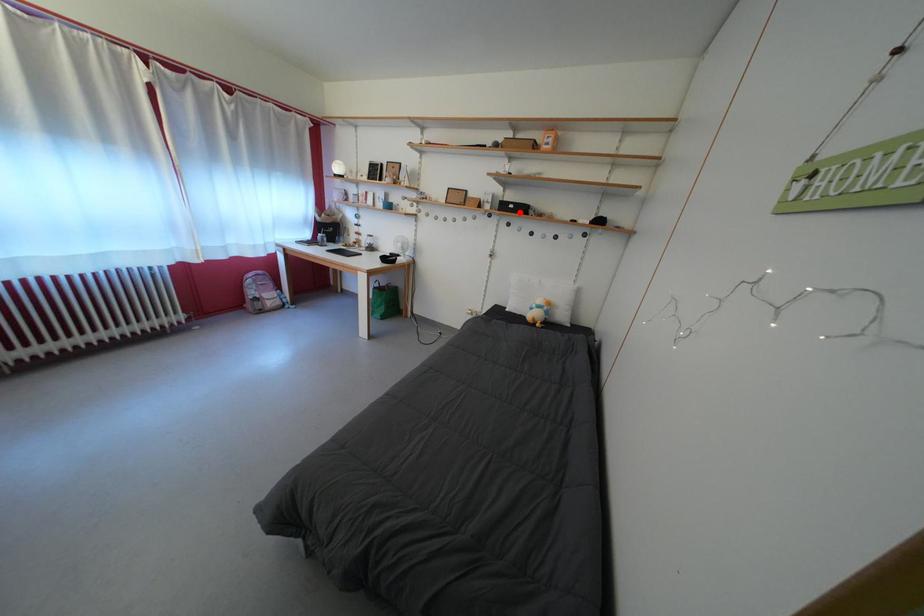
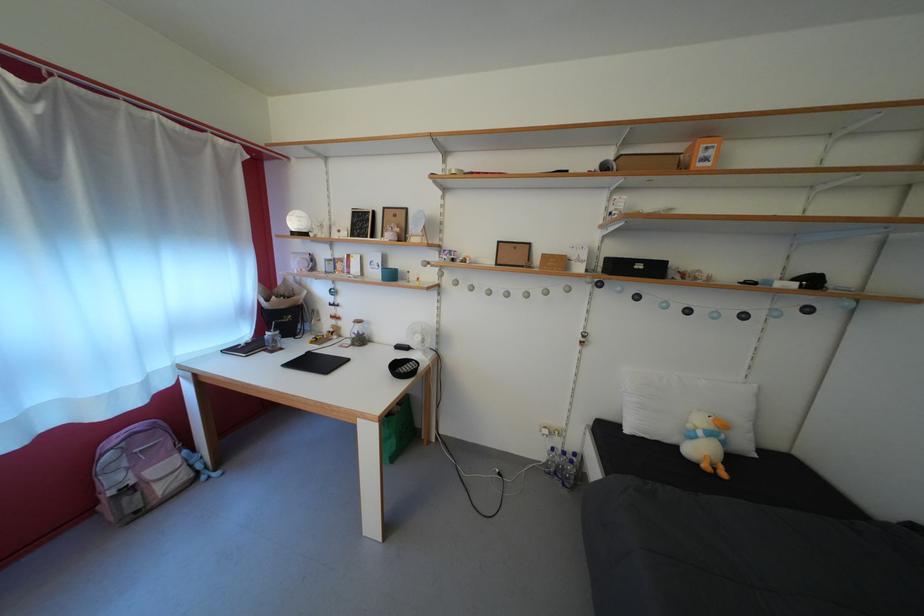
Where in the second image is the point corresponding to the highlighted location from the first image?

(648, 273)